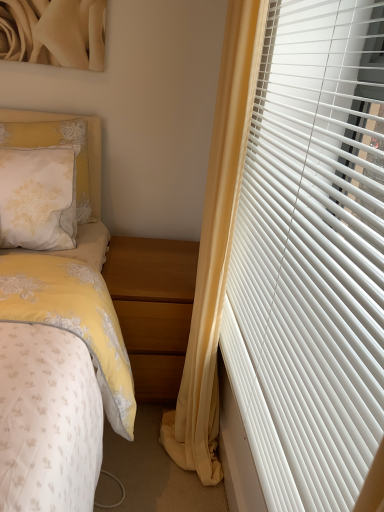
Question: Would you say light brown wood at lower center is to the left or to the right of yellow fabric curtain at right in the picture?

Choices:
 (A) right
 (B) left

Answer: (B)

Question: From a real-world perspective, is light brown wood at lower center physically located above or below yellow fabric curtain at right?

Choices:
 (A) above
 (B) below

Answer: (B)

Question: Based on their relative distances, which object is nearer to the white lace pillow at upper left?

Choices:
 (A) white plastic blinds at right
 (B) light brown wood at lower center
 (C) yellow fabric curtain at right

Answer: (B)

Question: Which object is the closest to the white lace pillow at upper left?

Choices:
 (A) light brown wood at lower center
 (B) yellow fabric curtain at right
 (C) white plastic blinds at right

Answer: (A)